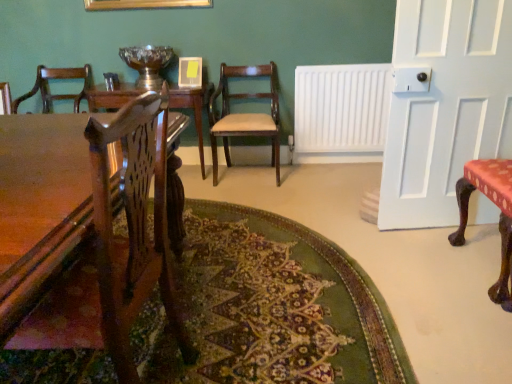
Locate an element on the screen. Image resolution: width=512 pixels, height=384 pixels. blank area beneath mahogany wood chair at center, the first chair when ordered from back to front (from a real-world perspective) is located at coordinates click(x=246, y=177).